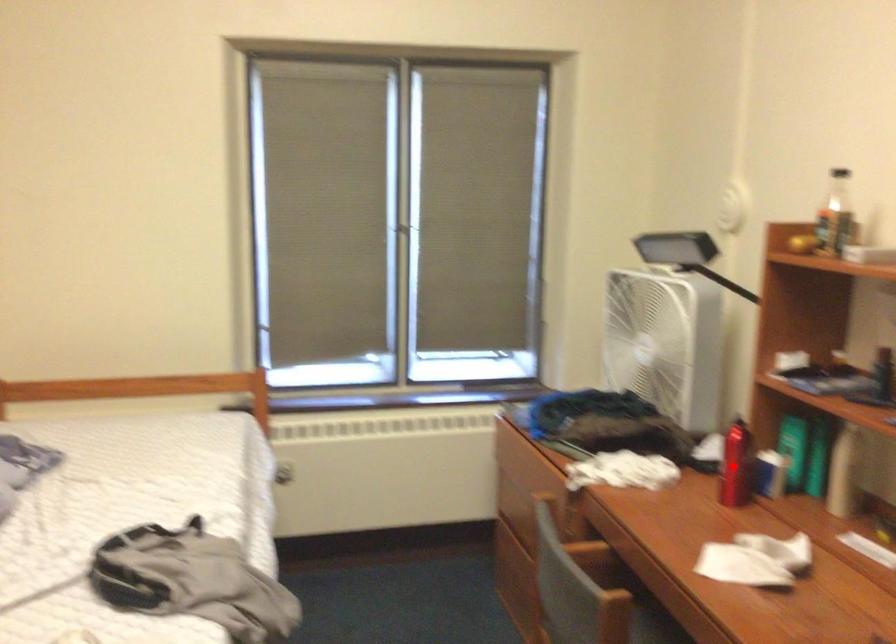
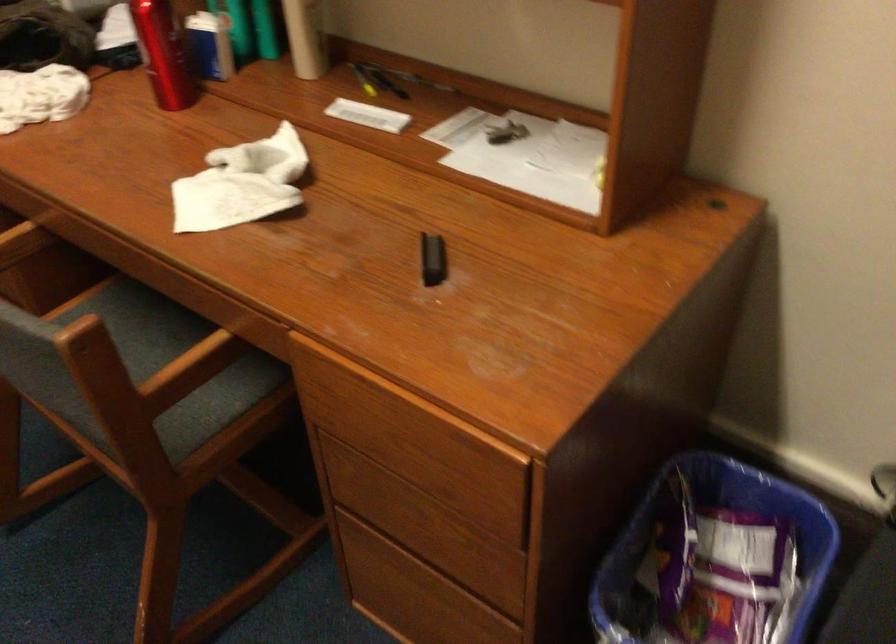
Where in the second image is the point corresponding to the highlighted location from the first image?

(162, 53)